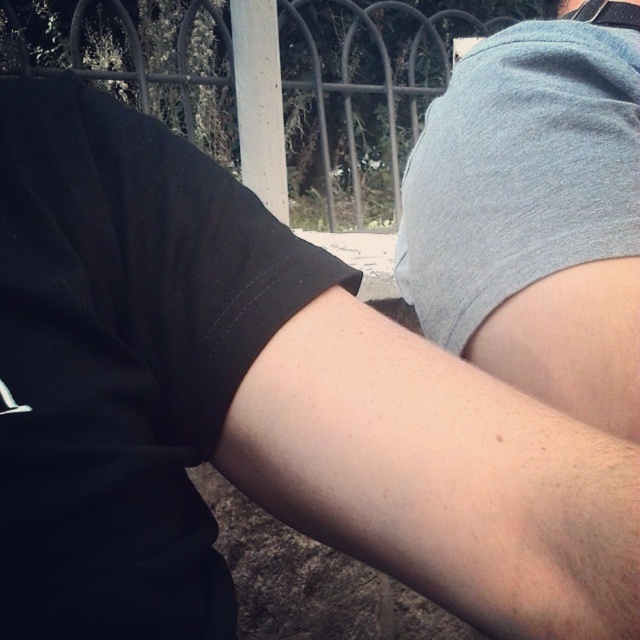
Who is positioned more to the right, skinny white arm at center or gray cotton shirt at upper right?

From the viewer's perspective, gray cotton shirt at upper right appears more on the right side.

Is skinny white arm at center below gray cotton shirt at upper right?

Indeed, skinny white arm at center is positioned under gray cotton shirt at upper right.

Between point (384, 371) and point (518, 141), which one is positioned in front?

Positioned in front is point (384, 371).

At what (x,y) coordinates should I click in order to perform the action: click on skinny white arm at center. Please return your answer as a coordinate pair (x, y). The image size is (640, 640). Looking at the image, I should click on (401, 445).